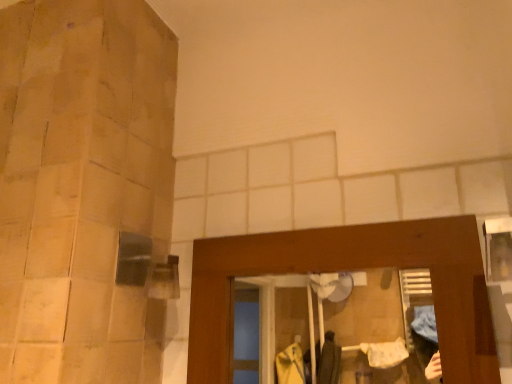
What is the approximate height of brown wooden mirror at center?

The height of brown wooden mirror at center is 11.65 inches.

At what (x,y) coordinates should I click in order to perform the action: click on brown wooden mirror at center. Please return your answer as a coordinate pair (x, y). The image size is (512, 384). Looking at the image, I should click on (350, 269).

Describe the element at coordinates (350, 269) in the screenshot. I see `brown wooden mirror at center` at that location.

In order to click on brown wooden mirror at center in this screenshot , I will do `click(350, 269)`.